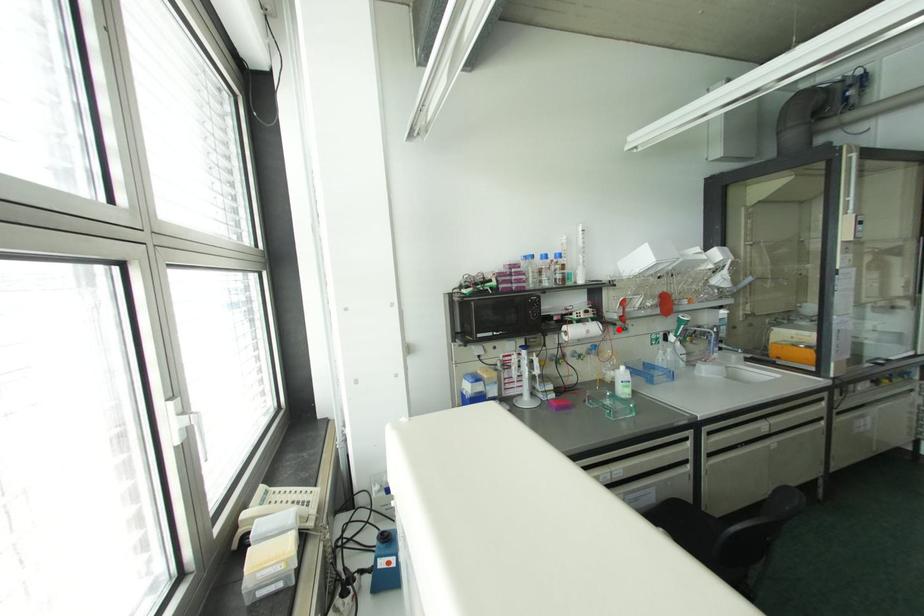
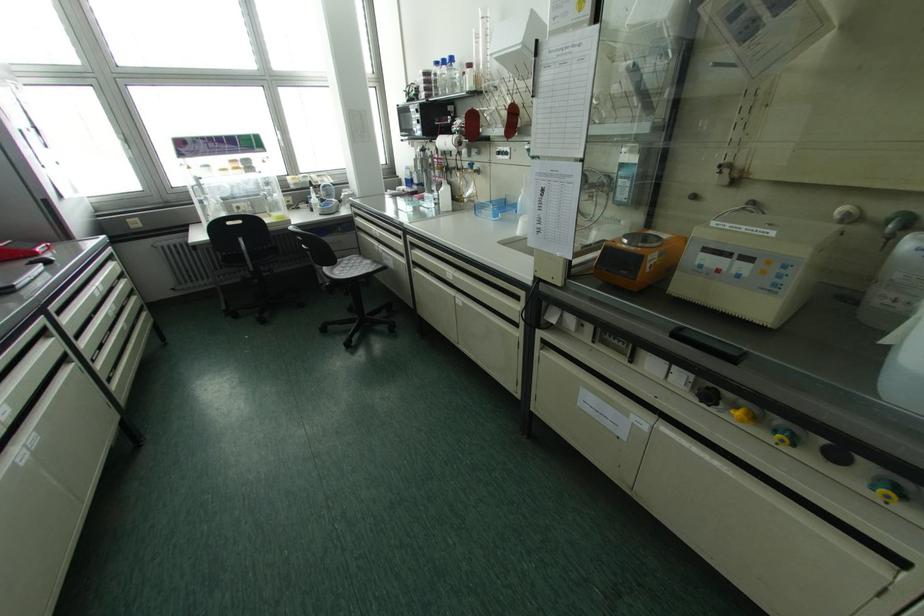
Question: A red point is marked in image1. In image2, is the corresponding 3D point closer to the camera or farther? Reply with the corresponding letter.

Choices:
 (A) The corresponding 3D point is closer.
 (B) The corresponding 3D point is farther.

Answer: (A)